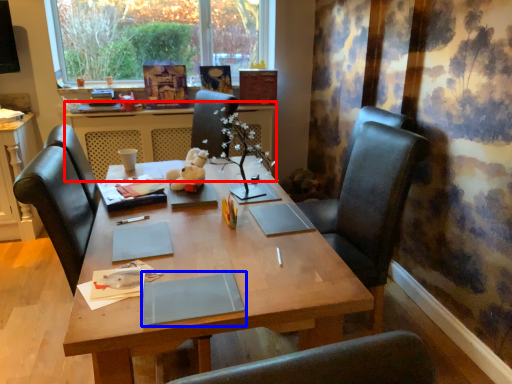
Question: Which point is closer to the camera, table (highlighted by a red box) or notebook (highlighted by a blue box)?

Choices:
 (A) table
 (B) notebook

Answer: (B)